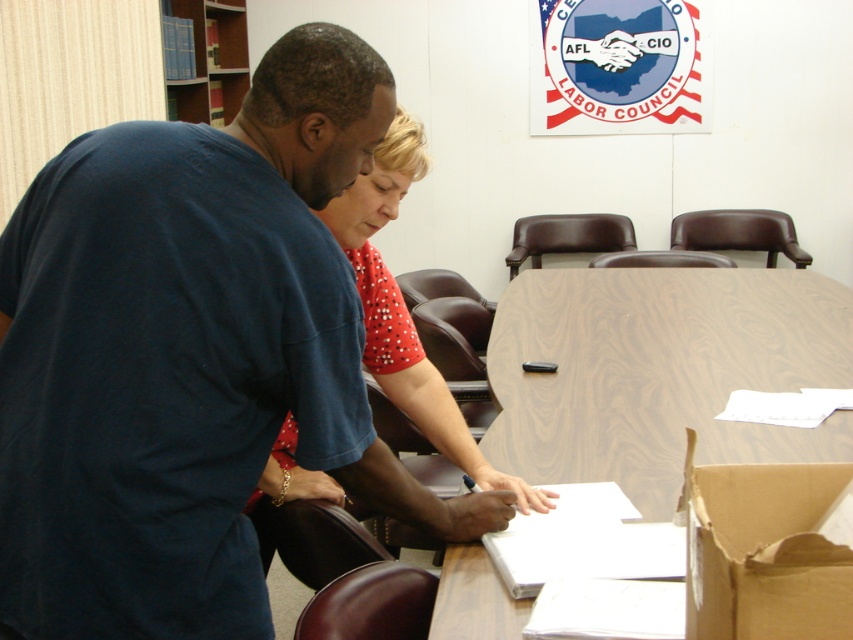
Question: Based on their relative distances, which object is nearer to the brown cardboard box at lower right?

Choices:
 (A) wooden table at center
 (B) dark blue shirt at upper left
 (C) red dotted blouse at center

Answer: (B)

Question: Which object is positioned closest to the brown cardboard box at lower right?

Choices:
 (A) wooden table at center
 (B) dark blue shirt at upper left

Answer: (B)

Question: Among these objects, which one is nearest to the camera?

Choices:
 (A) dark blue shirt at upper left
 (B) brown cardboard box at lower right
 (C) wooden table at center
 (D) red dotted blouse at center

Answer: (B)

Question: Is brown cardboard box at lower right smaller than red dotted blouse at center?

Choices:
 (A) no
 (B) yes

Answer: (B)

Question: Is dark blue shirt at upper left closer to camera compared to wooden table at center?

Choices:
 (A) yes
 (B) no

Answer: (A)

Question: Can you confirm if wooden table at center is positioned above brown cardboard box at lower right?

Choices:
 (A) no
 (B) yes

Answer: (B)